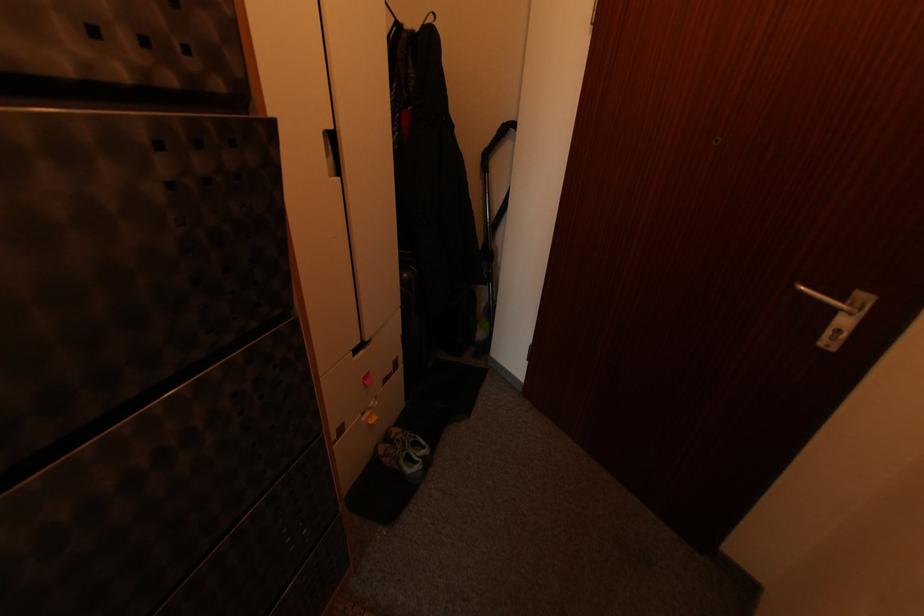
Find the location of `black cabinet handle`. black cabinet handle is located at coordinates (332, 152).